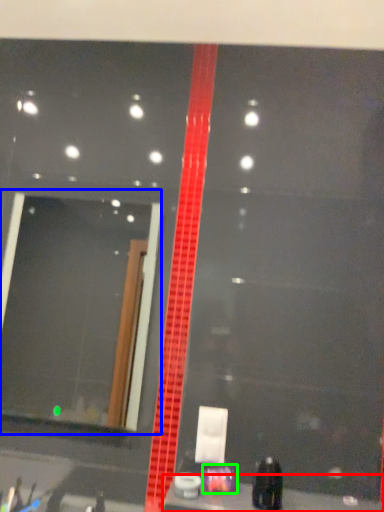
Question: Based on their relative distances, which object is farther from counter top (highlighted by a red box)? Choose from mirror (highlighted by a blue box) and toiletry (highlighted by a green box).

Choices:
 (A) mirror
 (B) toiletry

Answer: (A)